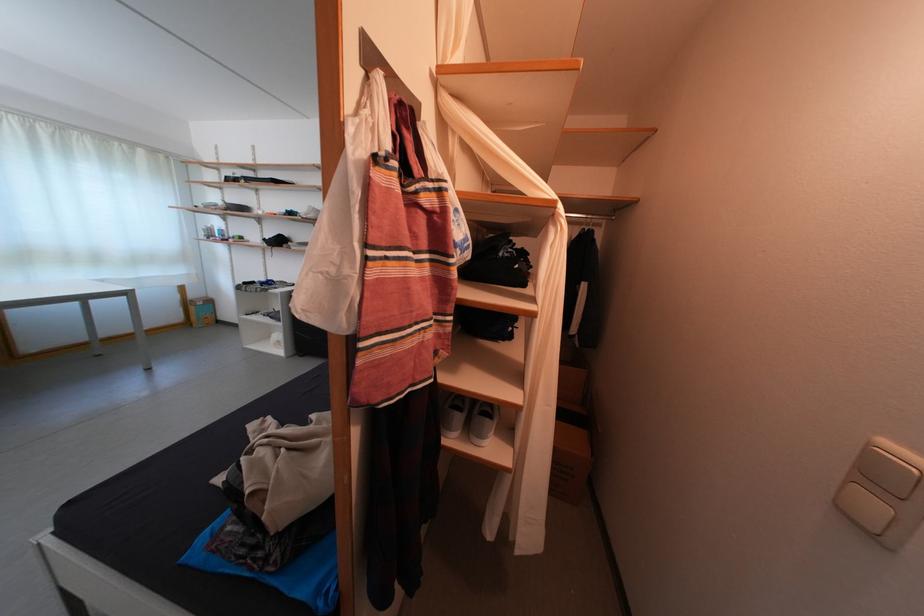
Locate an element on the screen. This screenshot has width=924, height=616. striped tote bag is located at coordinates (403, 288).